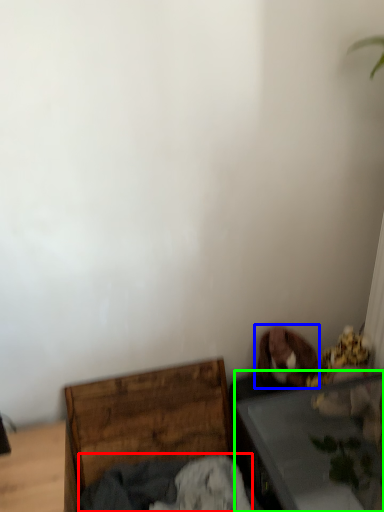
Question: Which is farther away from clothing (highlighted by a red box)? dog (highlighted by a blue box) or table (highlighted by a green box)?

Choices:
 (A) dog
 (B) table

Answer: (A)